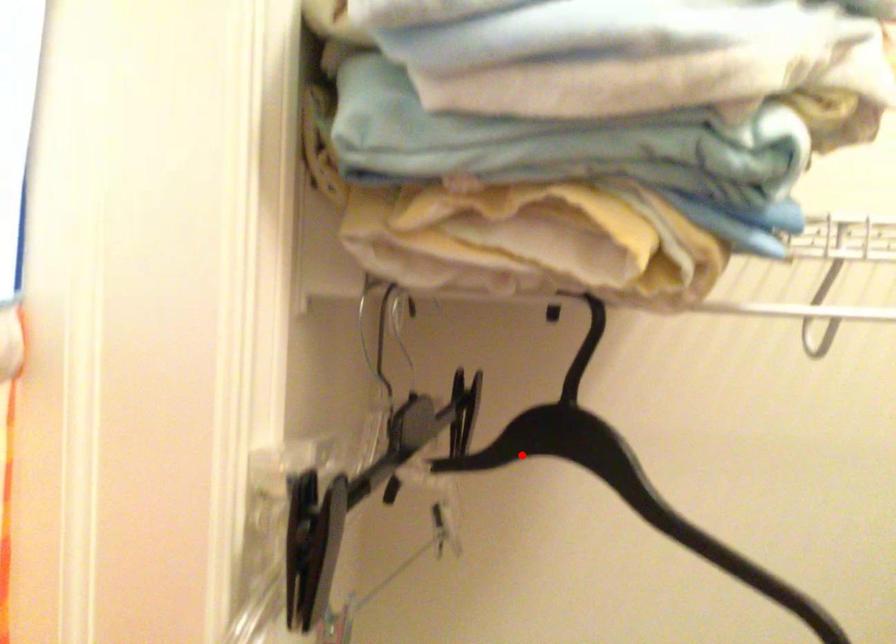
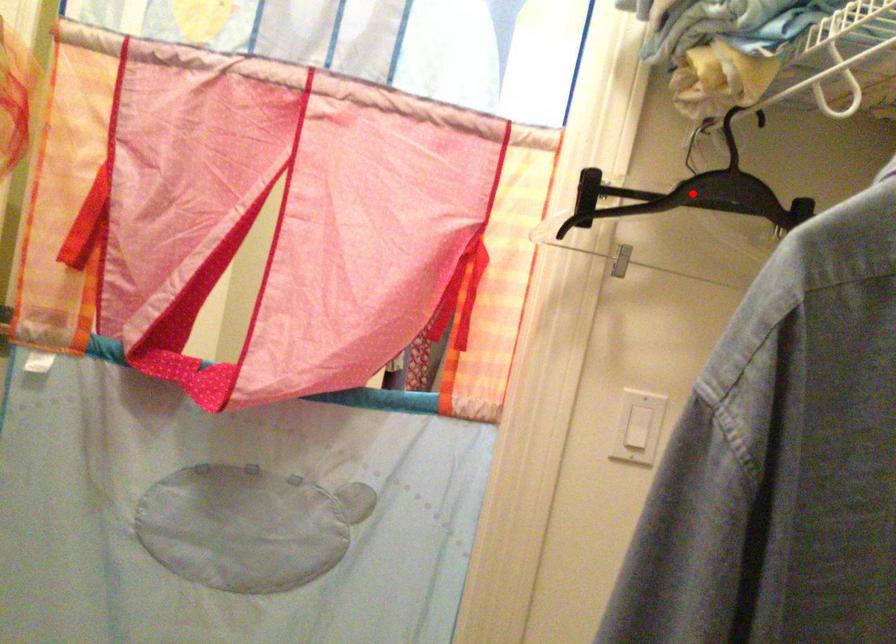
I am providing you with two images of the same scene from different viewpoints. A red point is marked on the first image and another point is marked on the second image. Is the marked point in image1 the same physical position as the marked point in image2?

Yes